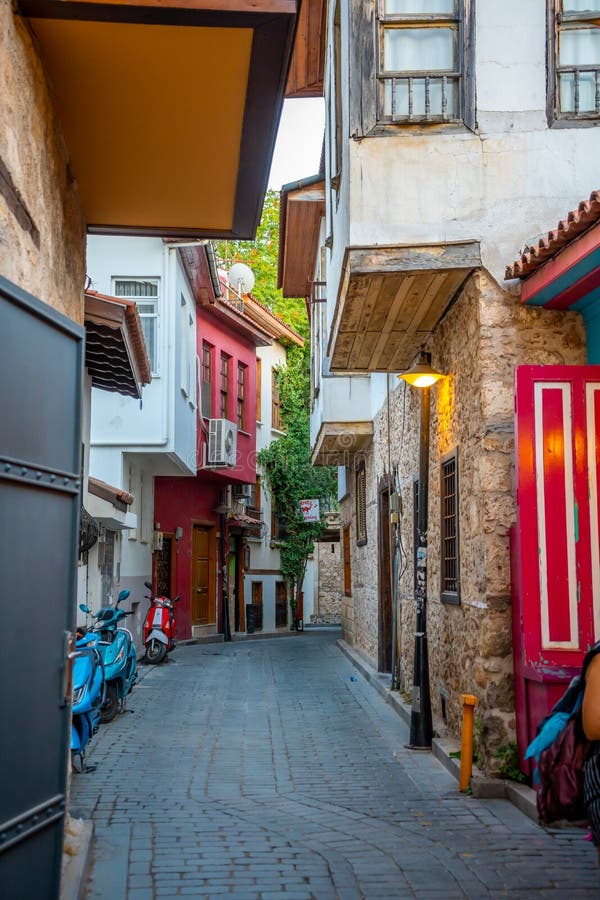
The height and width of the screenshot is (900, 600). I want to click on red panel, so click(562, 619).